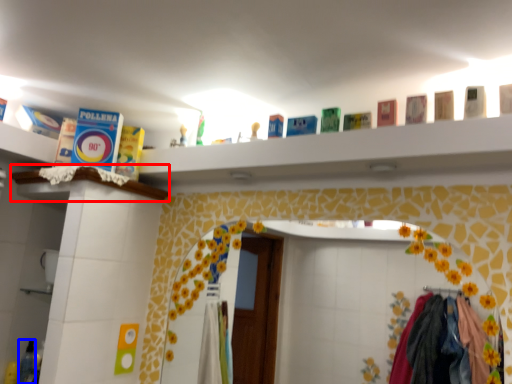
Question: Which of the following is the farthest to the observer, ledge (highlighted by a red box) or toiletry (highlighted by a blue box)?

Choices:
 (A) ledge
 (B) toiletry

Answer: (B)